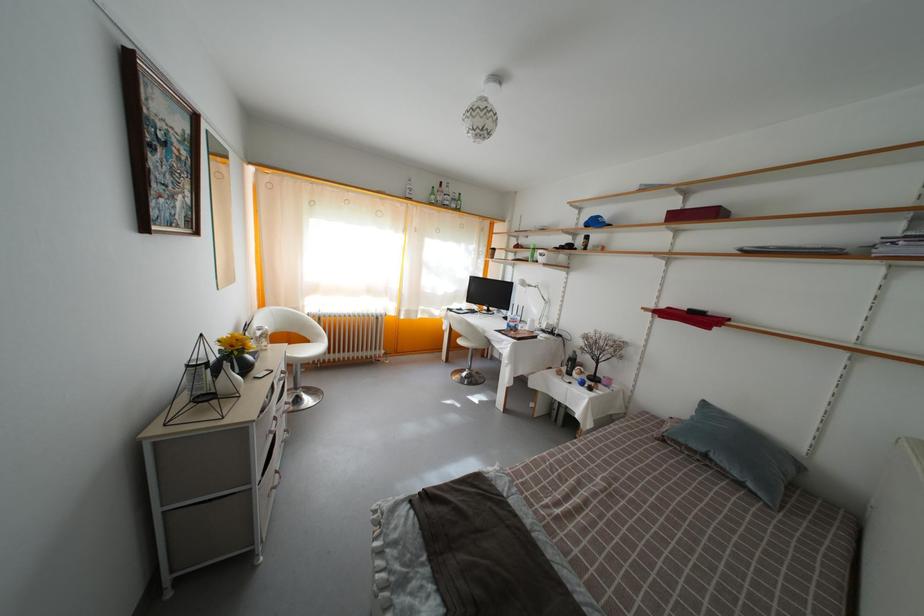
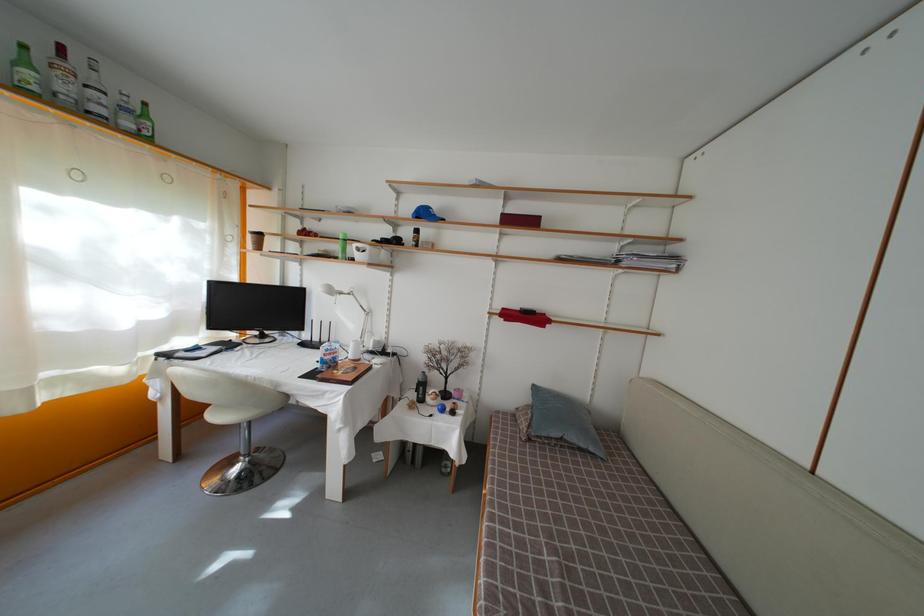
Locate, in the second image, the point that corresponds to [439,200] in the first image.

(31, 69)